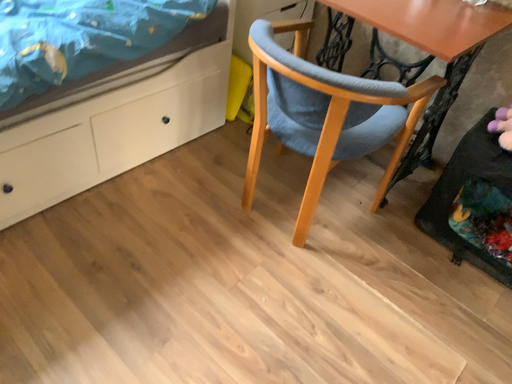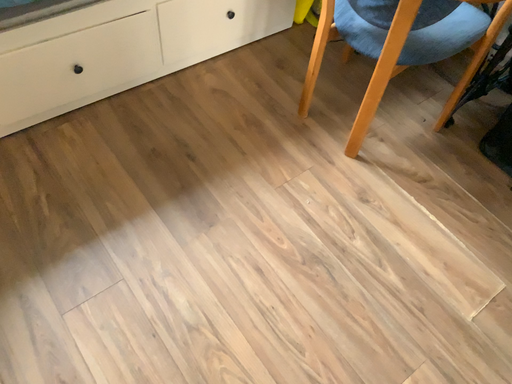
Question: Which way did the camera rotate in the video?

Choices:
 (A) rotated left
 (B) rotated right

Answer: (A)